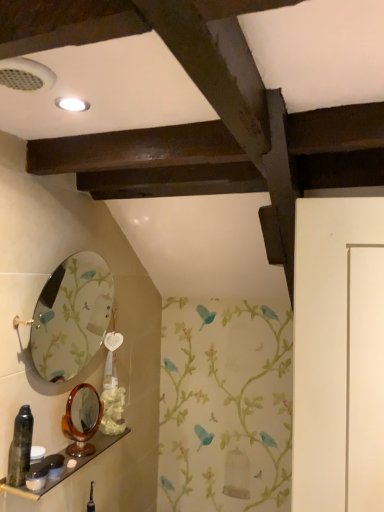
Question: From the image's perspective, is wooden shelf at lower left beneath matte black container at lower left?

Choices:
 (A) yes
 (B) no

Answer: (A)

Question: Is wooden shelf at lower left in front of matte black container at lower left?

Choices:
 (A) yes
 (B) no

Answer: (A)

Question: Can you confirm if wooden shelf at lower left is positioned to the left of matte black container at lower left?

Choices:
 (A) yes
 (B) no

Answer: (B)

Question: Can you confirm if wooden shelf at lower left is thinner than matte black container at lower left?

Choices:
 (A) no
 (B) yes

Answer: (A)

Question: Can you confirm if wooden shelf at lower left is smaller than matte black container at lower left?

Choices:
 (A) yes
 (B) no

Answer: (B)

Question: Does point (18, 462) appear closer or farther from the camera than point (69, 454)?

Choices:
 (A) closer
 (B) farther

Answer: (A)

Question: From a real-world perspective, is matte black spray can at lower left above or below brown glossy mirror at center, the first mirror when ordered from bottom to top?

Choices:
 (A) below
 (B) above

Answer: (B)

Question: Considering the relative positions of matte black spray can at lower left and brown glossy mirror at center, the first mirror when ordered from bottom to top, in the image provided, is matte black spray can at lower left to the left or to the right of brown glossy mirror at center, the first mirror when ordered from bottom to top,?

Choices:
 (A) right
 (B) left

Answer: (B)

Question: Considering the positions of matte black spray can at lower left and brown glossy mirror at center, the first mirror when ordered from bottom to top, in the image, is matte black spray can at lower left wider or thinner than brown glossy mirror at center, the first mirror when ordered from bottom to top,?

Choices:
 (A) wide
 (B) thin

Answer: (B)

Question: Considering the positions of point tap(84, 436) and point tap(18, 415), is point tap(84, 436) closer or farther from the camera than point tap(18, 415)?

Choices:
 (A) farther
 (B) closer

Answer: (A)

Question: From the image's perspective, is brown glossy mirror at center, the 2th mirror positioned from the top, positioned above or below matte black spray can at lower left?

Choices:
 (A) above
 (B) below

Answer: (B)

Question: From a real-world perspective, relative to matte black spray can at lower left, is brown glossy mirror at center, the first mirror when ordered from bottom to top, vertically above or below?

Choices:
 (A) above
 (B) below

Answer: (B)

Question: Based on their positions, is brown glossy mirror at center, the first mirror when ordered from bottom to top, located to the left or right of matte black spray can at lower left?

Choices:
 (A) right
 (B) left

Answer: (A)

Question: From a real-world perspective, is wooden shelf at lower left above or below oval glass mirror at upper left, placed as the 2th mirror when sorted from bottom to top?

Choices:
 (A) above
 (B) below

Answer: (B)

Question: Considering their positions, is wooden shelf at lower left located in front of or behind oval glass mirror at upper left, which is counted as the first mirror, starting from the top?

Choices:
 (A) behind
 (B) front

Answer: (B)